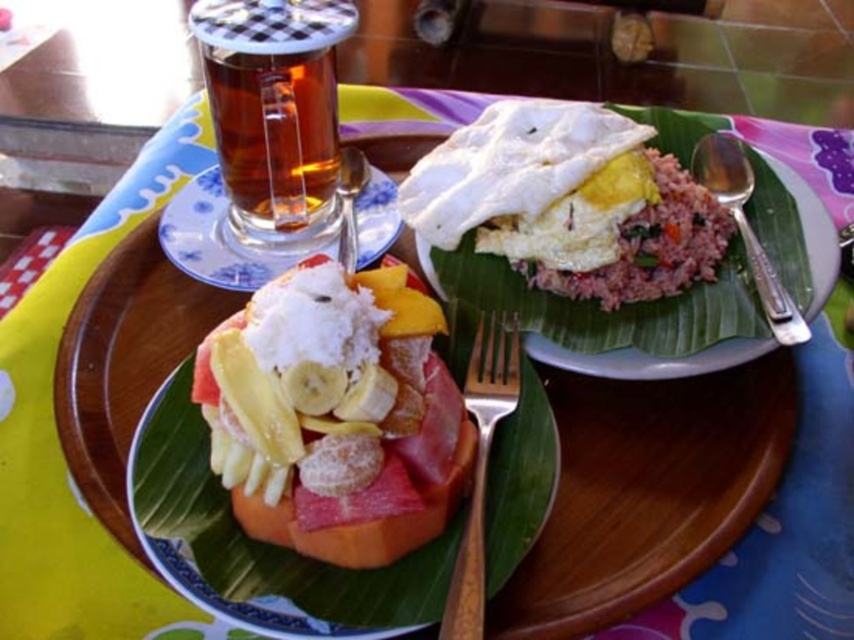
Question: Which point is farther from the camera taking this photo?

Choices:
 (A) (495, 403)
 (B) (493, 166)
 (C) (260, 163)
 (D) (153, 410)

Answer: (C)

Question: Does sugary white fruit at center appear over translucent glass mug at upper left?

Choices:
 (A) no
 (B) yes

Answer: (A)

Question: Which point appears closest to the camera in this image?

Choices:
 (A) (446, 196)
 (B) (414, 380)

Answer: (B)

Question: Can you confirm if clear glass cup at upper left is wider than satin silver spoon at upper center?

Choices:
 (A) no
 (B) yes

Answer: (B)

Question: Does translucent glass mug at upper left have a lesser width compared to satin silver spoon at upper center?

Choices:
 (A) no
 (B) yes

Answer: (A)

Question: Estimate the real-world distances between objects in this image. Which object is farther from the translucent glass mug at upper left?

Choices:
 (A) smooth papaya at center
 (B) white fluffy egg at center
 (C) sugary white fruit at center

Answer: (A)